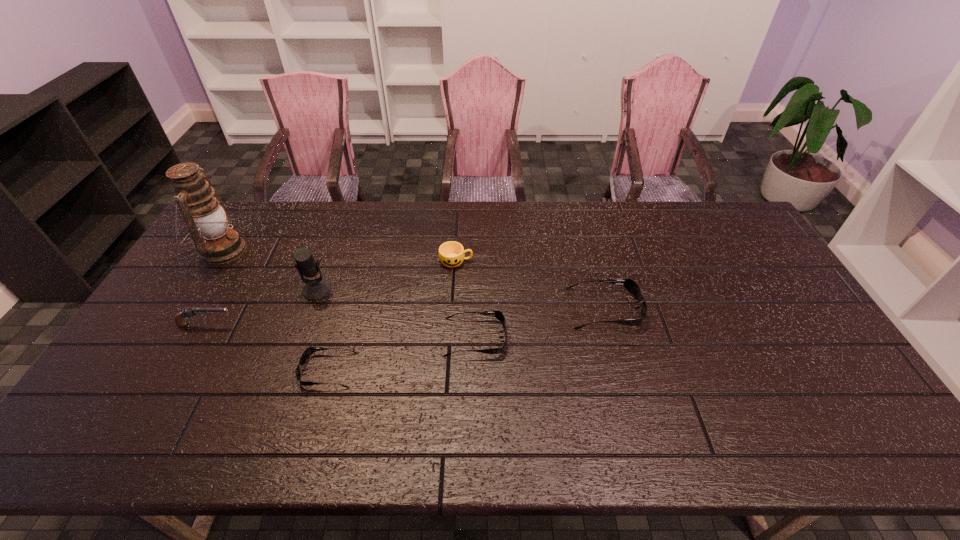
This screenshot has width=960, height=540. Find the location of `the shortest object`. the shortest object is located at coordinates (309, 351).

Find the location of a particular element. the leftmost sunglasses is located at coordinates (309, 351).

Where is `the second shortest object`? This screenshot has width=960, height=540. the second shortest object is located at coordinates (498, 314).

Where is `the second sunglasses from right to left`? The image size is (960, 540). the second sunglasses from right to left is located at coordinates (498, 314).

Find the location of a particular element. This screenshot has width=960, height=540. the rightmost object is located at coordinates (629, 284).

This screenshot has width=960, height=540. I want to click on the rightmost sunglasses, so click(x=629, y=284).

The width and height of the screenshot is (960, 540). I want to click on microphone, so (315, 289).

At what (x,y) coordinates should I click in order to perform the action: click on gun. Please return your answer as a coordinate pair (x, y). The height and width of the screenshot is (540, 960). Looking at the image, I should click on (187, 311).

Locate an element on the screen. The image size is (960, 540). cup is located at coordinates coord(451,254).

This screenshot has width=960, height=540. Identify the location of lantern. (208, 220).